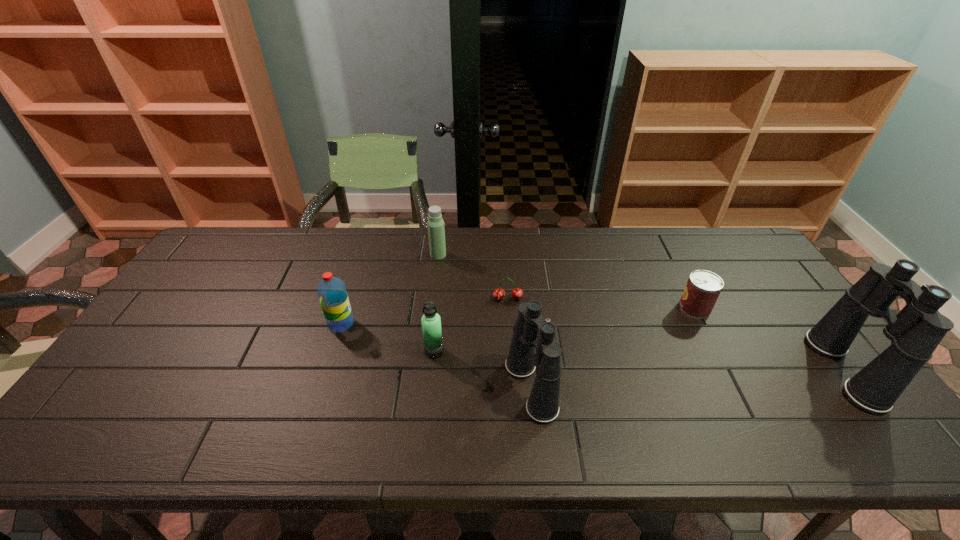
Image resolution: width=960 pixels, height=540 pixels. In order to click on free space located 0.240m on the right of the sixth shortest object in this screenshot , I will do `click(653, 388)`.

This screenshot has height=540, width=960. In order to click on free region located on the left of the right binoculars in this screenshot , I will do `click(762, 370)`.

This screenshot has width=960, height=540. Find the location of `free space located on the right of the farthest object`. free space located on the right of the farthest object is located at coordinates (536, 255).

This screenshot has width=960, height=540. I want to click on vacant space situated on the back of the second object from right to left, so click(662, 246).

Identify the location of vacant area located with stems pointing upwards on the cherry. The width and height of the screenshot is (960, 540). (516, 410).

Identify the location of blank space located 0.130m on the back of the nearer thermos bottle. The image size is (960, 540). (439, 310).

Identify the location of free space located on the front label of the water bottle. (404, 324).

Where is `object present at the far edge`? The width and height of the screenshot is (960, 540). object present at the far edge is located at coordinates (436, 231).

Where is `object at the right edge`? This screenshot has width=960, height=540. object at the right edge is located at coordinates (915, 332).

The height and width of the screenshot is (540, 960). In order to click on object that is at the near right corner in this screenshot , I will do `click(915, 332)`.